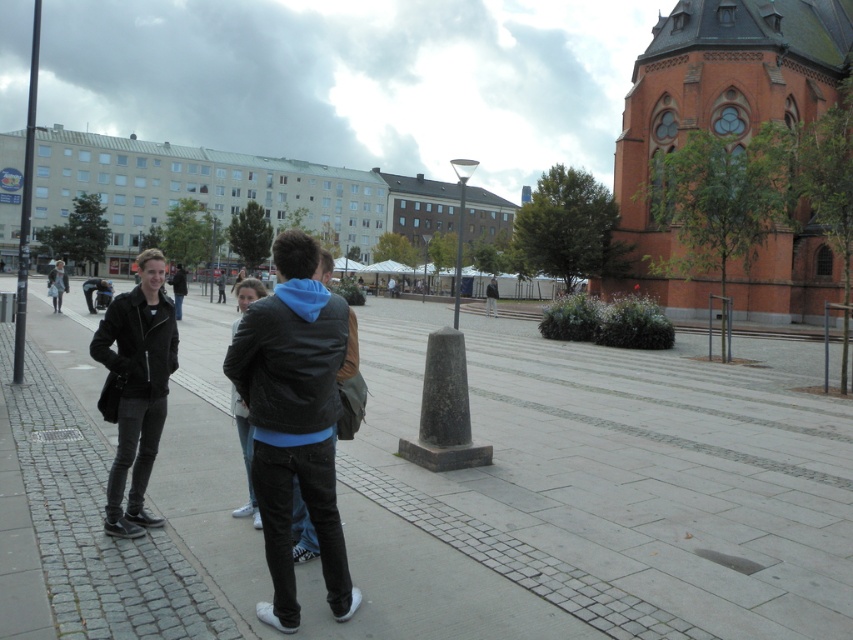
In the scene shown: Does black leather jacket at left have a larger size compared to matte black jacket at center?

Actually, black leather jacket at left might be smaller than matte black jacket at center.

Does point (305, 240) lie in front of point (305, 509)?

Yes, it is.

Who is more forward, (x=280, y=490) or (x=238, y=420)?

Point (x=280, y=490)

Locate an element on the screen. This screenshot has width=853, height=640. black leather jacket at left is located at coordinates (294, 420).

From the picture: Is the position of matte black jacket at left less distant than that of dark gray leather jacket at left?

Yes, it is.

Does matte black jacket at left appear on the right side of dark gray leather jacket at left?

Indeed, matte black jacket at left is positioned on the right side of dark gray leather jacket at left.

Between point (113, 353) and point (177, 285), which one is positioned in front?

Positioned in front is point (113, 353).

The height and width of the screenshot is (640, 853). What are the coordinates of `matte black jacket at left` in the screenshot? It's located at (137, 387).

Between black leather jacket at left and dark gray leather jacket at center, which one is positioned higher?

Positioned higher is dark gray leather jacket at center.

Can you confirm if black leather jacket at left is positioned to the right of dark gray leather jacket at center?

Incorrect, black leather jacket at left is not on the right side of dark gray leather jacket at center.

This screenshot has height=640, width=853. I want to click on black leather jacket at left, so click(294, 420).